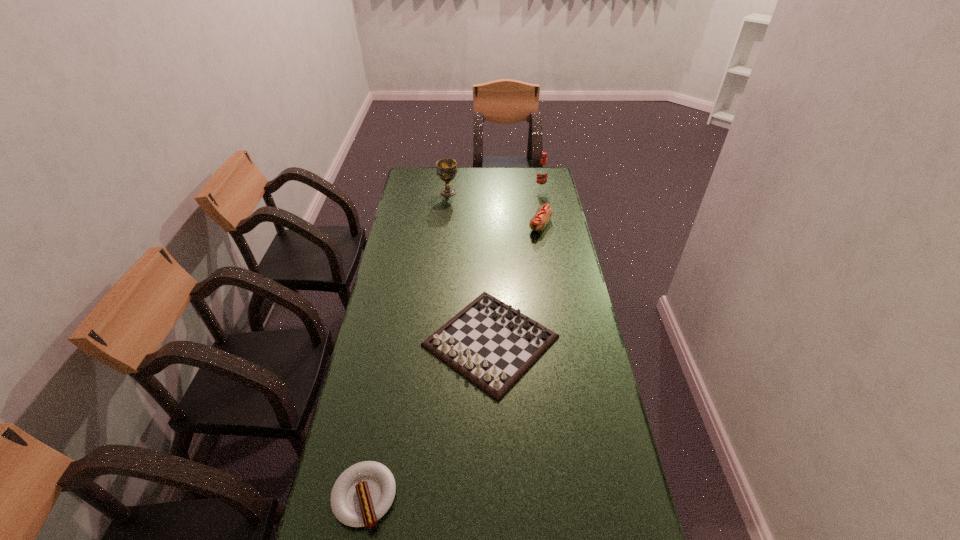
Locate an element on the screen. The image size is (960, 540). vacant space at the left edge of the desktop is located at coordinates (392, 294).

Find the location of a particular element. vacant area at the right edge of the desktop is located at coordinates (530, 204).

In the image, there is a desktop. At what (x,y) coordinates should I click in order to perform the action: click on vacant region at the far left corner. Please return your answer as a coordinate pair (x, y). The height and width of the screenshot is (540, 960). Looking at the image, I should click on (408, 177).

This screenshot has width=960, height=540. Identify the location of free area in between the root beer and the second nearest object. (516, 265).

Identify the location of vacant area that lies between the third farthest object and the chalice. (494, 209).

Where is `vacant space in between the fourth shortest object and the nearer sausage`? This screenshot has width=960, height=540. vacant space in between the fourth shortest object and the nearer sausage is located at coordinates (406, 345).

Identify which object is the fourth closest to the nearer sausage. Please provide its 2D coordinates. Your answer should be formatted as a tuple, i.e. [(x, y)], where the tuple contains the x and y coordinates of a point satisfying the conditions above.

[(542, 173)]

This screenshot has height=540, width=960. Find the location of `object that is the nearest to the second tallest object`. object that is the nearest to the second tallest object is located at coordinates (544, 213).

Point out which sausage is positioned as the second nearest to the chalice. Please provide its 2D coordinates. Your answer should be formatted as a tuple, i.e. [(x, y)], where the tuple contains the x and y coordinates of a point satisfying the conditions above.

[(363, 493)]

Find the location of a particular element. The height and width of the screenshot is (540, 960). vacant space that satisfies the following two spatial constraints: 1. on the back side of the chalice; 2. on the left side of the nearer sausage is located at coordinates (421, 192).